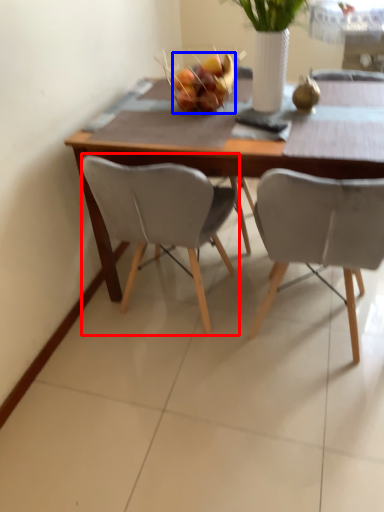
Question: Which of the following is the farthest to the observer, chair (highlighted by a red box) or fruit (highlighted by a blue box)?

Choices:
 (A) chair
 (B) fruit

Answer: (B)